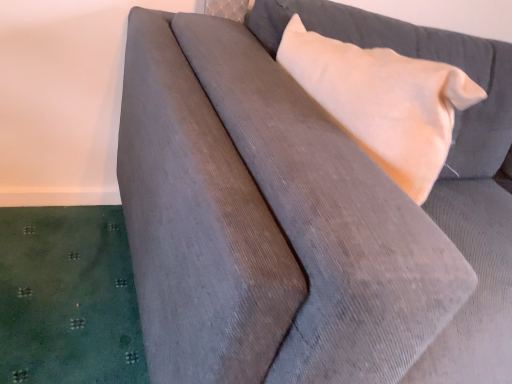
Question: Should I look upward or downward to see corduroy beige pillow at upper right?

Choices:
 (A) down
 (B) up

Answer: (B)